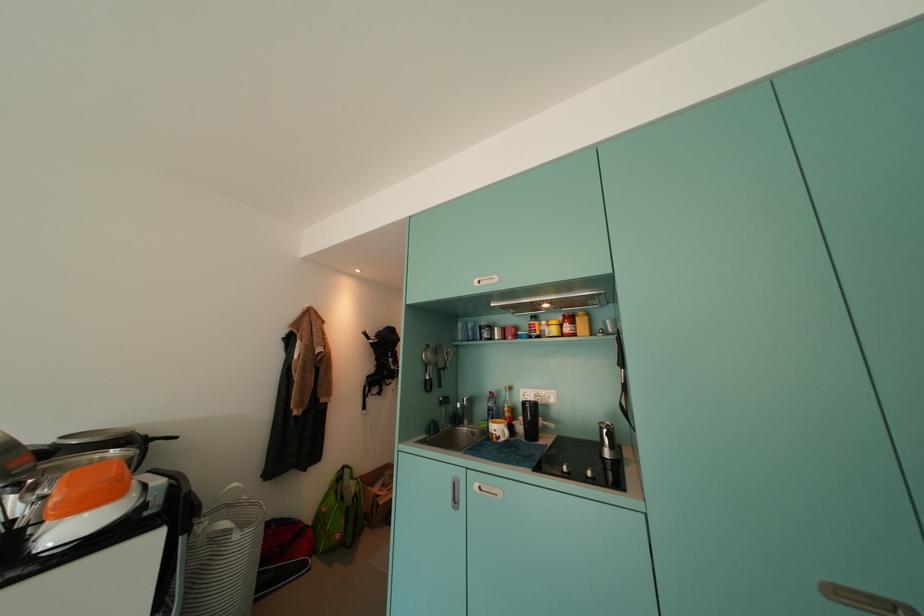
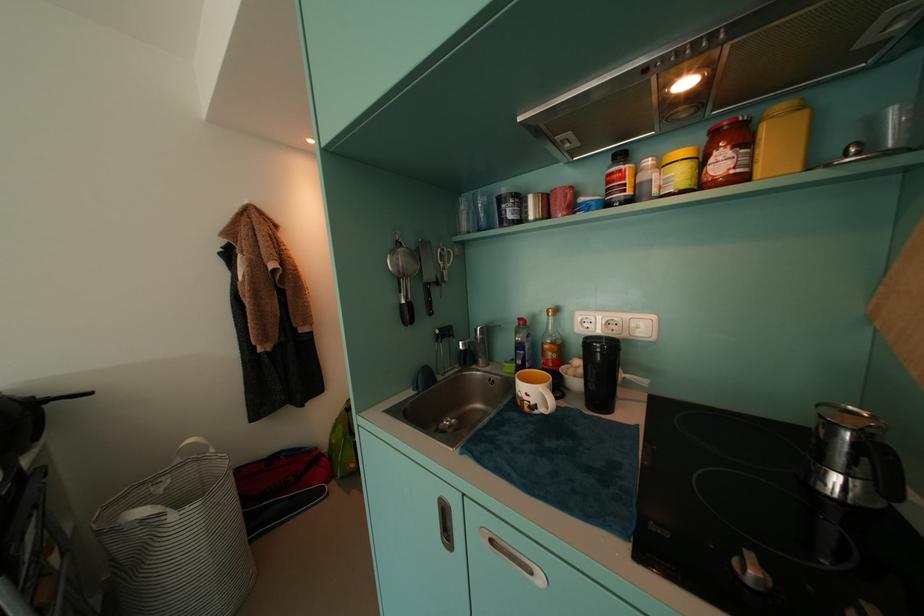
Question: The images are taken continuously from a first-person perspective. In which direction are you moving?

Choices:
 (A) Left
 (B) Right
 (C) Forward
 (D) Backward

Answer: (C)